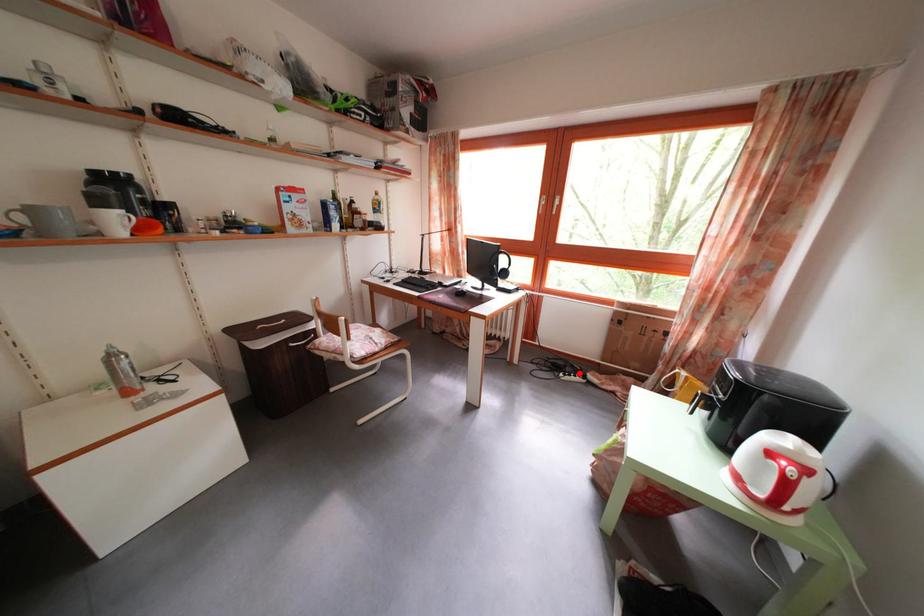
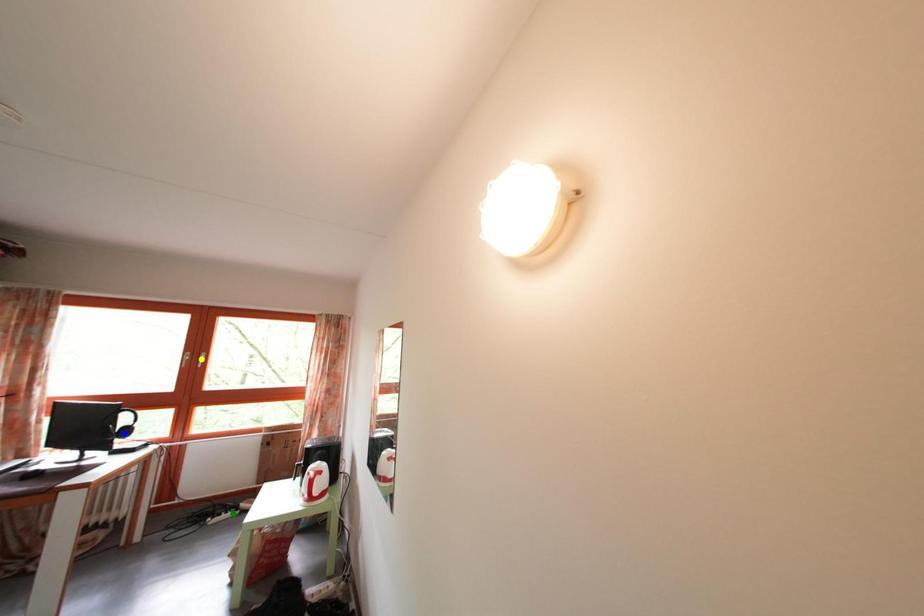
Question: I am providing you with two images of the same scene from different viewpoints. A red point is marked on the first image. You are given multiple points on the second image. Which mark in image 2 goes with the point in image 1?

Choices:
 (A) green point
 (B) blue point
 (C) yellow point

Answer: (A)